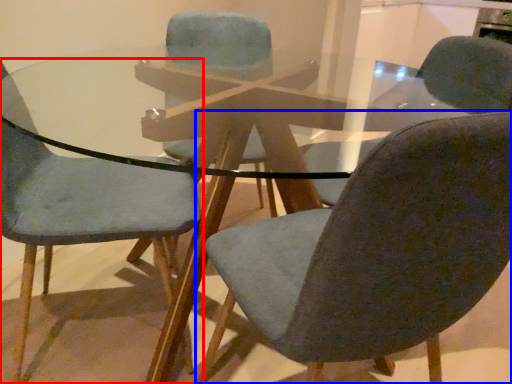
Question: Which of the following is the farthest to the observer, chair (highlighted by a red box) or chair (highlighted by a blue box)?

Choices:
 (A) chair
 (B) chair

Answer: (A)